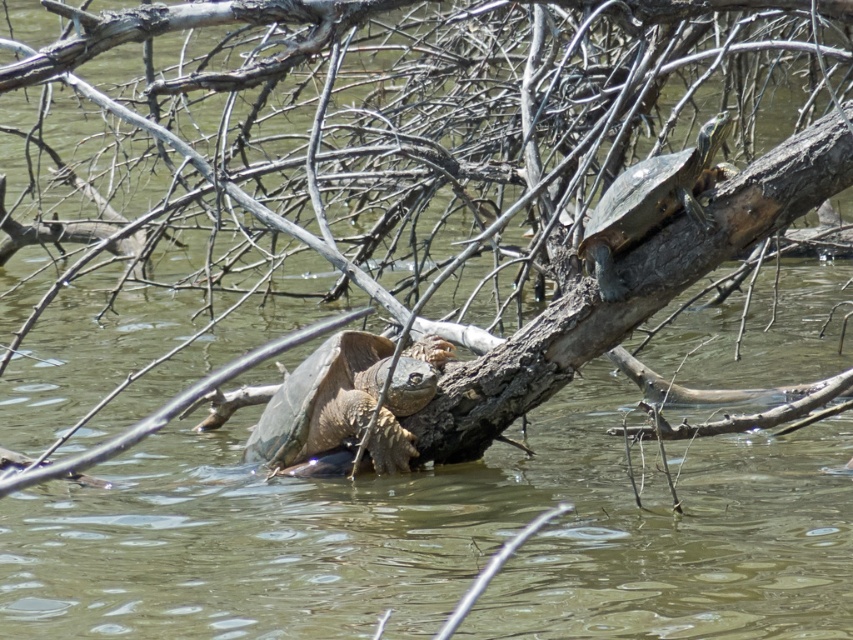
Which is in front, point (250, 456) or point (682, 161)?

Positioned in front is point (682, 161).

Who is higher up, leathery brown tortoise at center or smooth brown tortoise at upper right?

smooth brown tortoise at upper right is higher up.

The width and height of the screenshot is (853, 640). I want to click on leathery brown tortoise at center, so click(347, 401).

Find the location of a particular element. The image size is (853, 640). leathery brown tortoise at center is located at coordinates (347, 401).